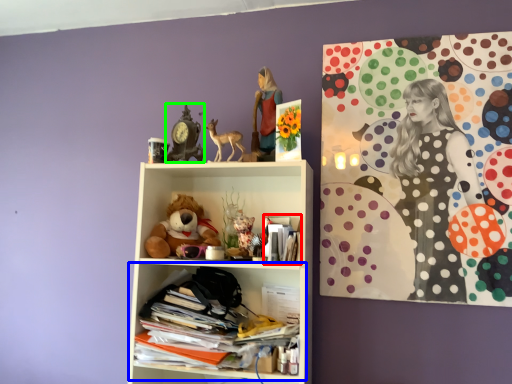
Question: Estimate the real-world distances between objects in this image. Which object is closer to magazine (highlighted by a red box), shelf (highlighted by a blue box) or art (highlighted by a green box)?

Choices:
 (A) shelf
 (B) art

Answer: (A)